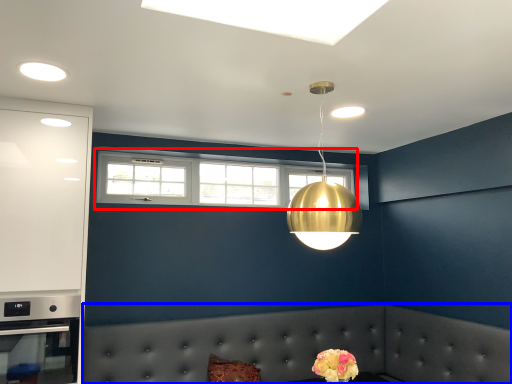
Question: Which of the following is the farthest to the observer, window (highlighted by a red box) or couch (highlighted by a blue box)?

Choices:
 (A) window
 (B) couch

Answer: (A)